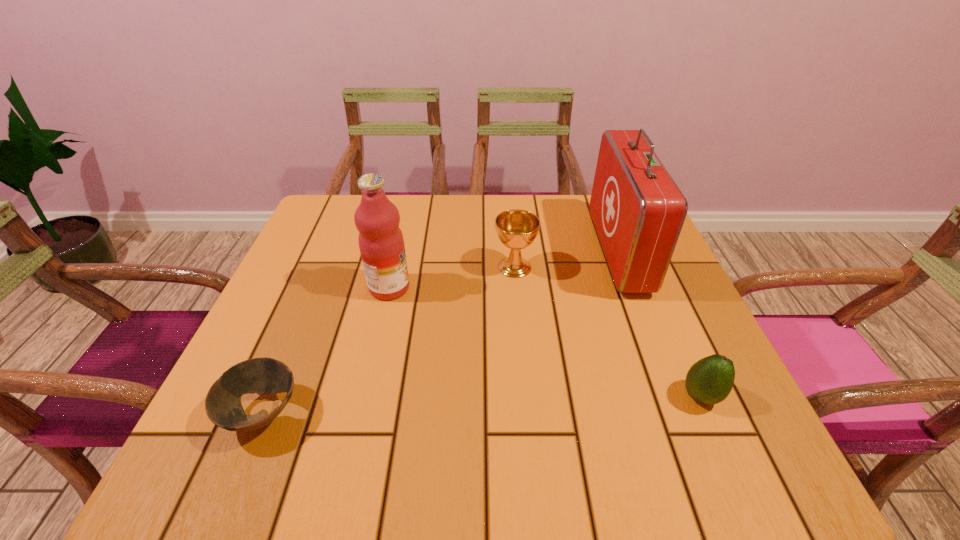
Locate an element on the screen. object positioned at the far right corner is located at coordinates (638, 211).

In the image, there is a desktop. In order to click on blank space at the far edge in this screenshot , I will do `click(491, 215)`.

This screenshot has height=540, width=960. Find the location of `vacant space at the near edge of the desktop`. vacant space at the near edge of the desktop is located at coordinates click(x=324, y=447).

Locate an element on the screen. The width and height of the screenshot is (960, 540). free space at the left edge is located at coordinates (306, 291).

In the image, there is a desktop. At what (x,y) coordinates should I click in order to perform the action: click on vacant region at the right edge. Please return your answer as a coordinate pair (x, y). The image size is (960, 540). Looking at the image, I should click on (653, 333).

The width and height of the screenshot is (960, 540). In the image, there is a desktop. What are the coordinates of `vacant space at the far left corner` in the screenshot? It's located at (329, 195).

This screenshot has height=540, width=960. Find the location of `free space between the bowl and the avocado`. free space between the bowl and the avocado is located at coordinates (482, 405).

At what (x,y) coordinates should I click in order to perform the action: click on unoccupied position between the first-aid kit and the leftmost object. Please return your answer as a coordinate pair (x, y). Looking at the image, I should click on click(x=441, y=332).

Identify the location of vacant region between the second shortest object and the third shortest object. pyautogui.click(x=608, y=332).

This screenshot has height=540, width=960. In order to click on unoccupied position between the bowl and the third shortest object in this screenshot , I will do `click(389, 340)`.